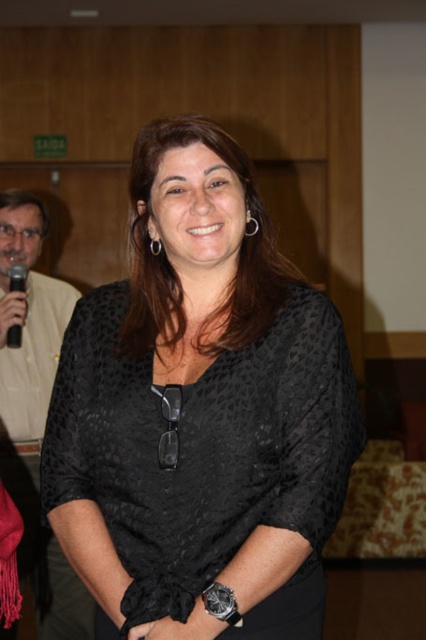
Question: Which point is closer to the camera taking this photo?

Choices:
 (A) pyautogui.click(x=26, y=220)
 (B) pyautogui.click(x=20, y=282)
 (C) pyautogui.click(x=112, y=472)

Answer: (C)

Question: Which object is positioned closest to the black dotted blouse at center?

Choices:
 (A) matte beige shirt at left
 (B) black plastic microphone at left

Answer: (B)

Question: Is black dotted blouse at center thinner than black plastic microphone at left?

Choices:
 (A) yes
 (B) no

Answer: (B)

Question: Based on their relative distances, which object is nearer to the black dotted blouse at center?

Choices:
 (A) matte beige shirt at left
 (B) black plastic microphone at left

Answer: (B)

Question: Is black dotted blouse at center above black plastic microphone at left?

Choices:
 (A) no
 (B) yes

Answer: (A)

Question: Can you confirm if black dotted blouse at center is thinner than black plastic microphone at left?

Choices:
 (A) no
 (B) yes

Answer: (A)